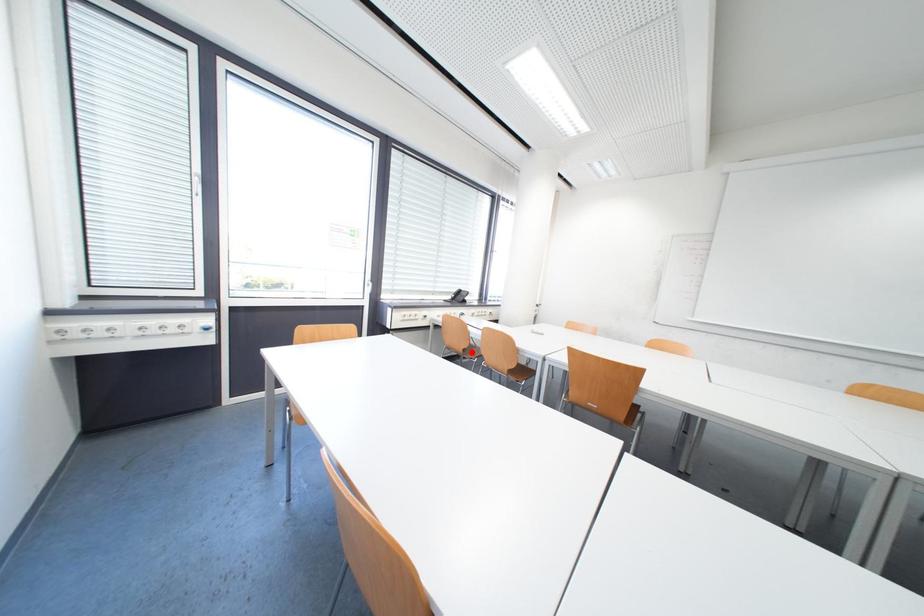
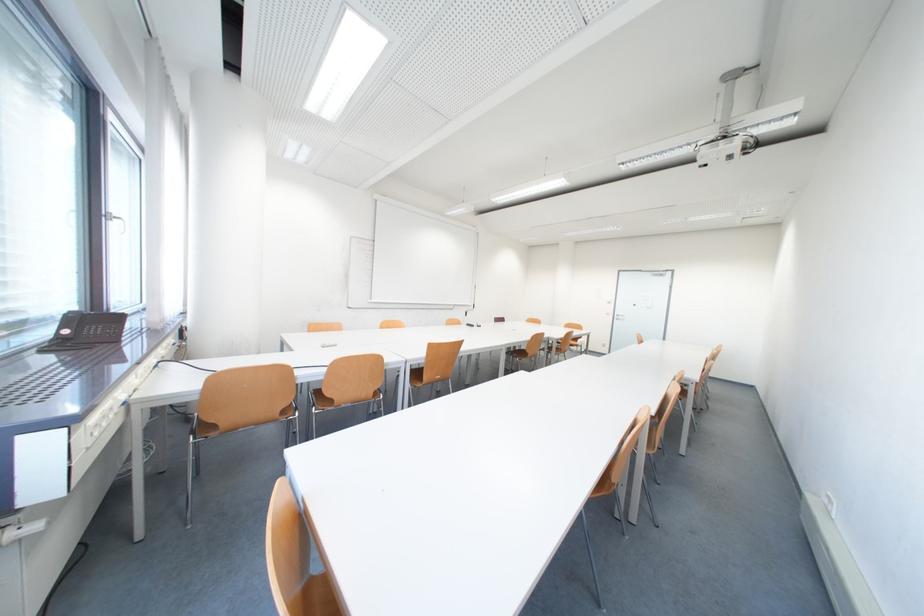
In the second image, find the point that corresponds to the highlighted location in the first image.

(287, 416)